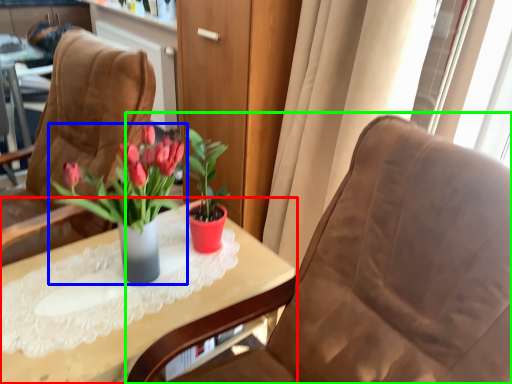
Question: Which object is the farthest from table (highlighted by a red box)? Choose among these: houseplant (highlighted by a blue box) or chair (highlighted by a green box).

Choices:
 (A) houseplant
 (B) chair

Answer: (B)